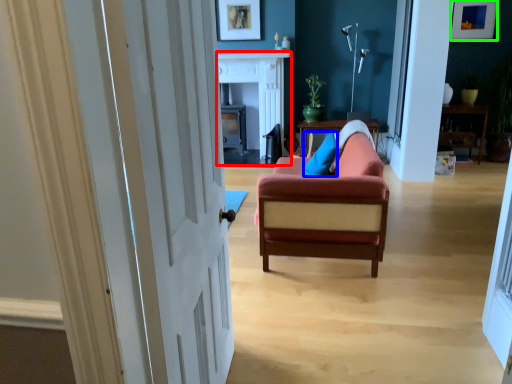
Question: Which is farther away from fireplace (highlighted by a red box)? pillow (highlighted by a blue box) or picture frame (highlighted by a green box)?

Choices:
 (A) pillow
 (B) picture frame

Answer: (B)